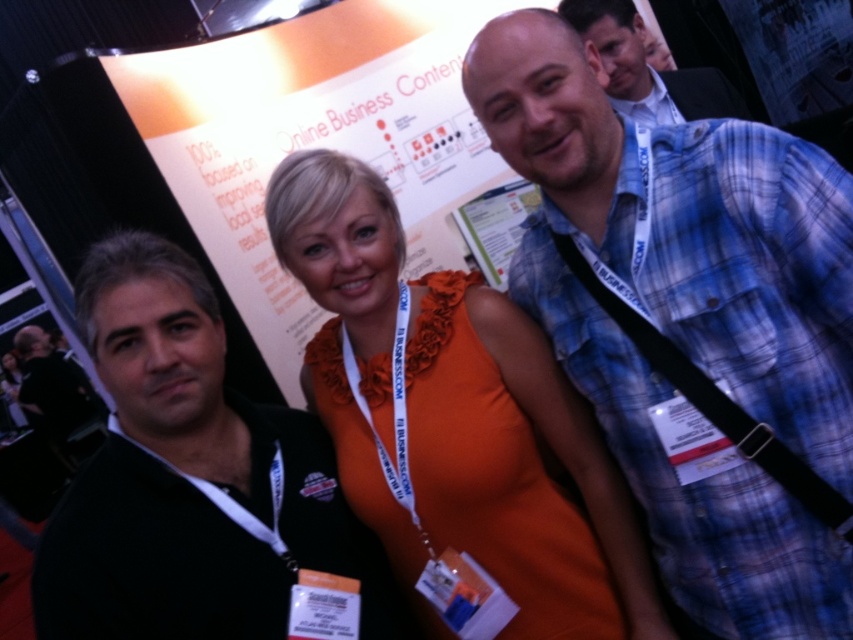
You are at a trade show and need to determine which item is narrower between the black fabric lanyard at right and the blue plaid shirt at upper right. Can you identify the narrower one?

The black fabric lanyard at right has a lesser width compared to the blue plaid shirt at upper right, so the black fabric lanyard at right is narrower.

From the picture: You are at a trade show and want to find the orange satin dress at center. Where should you look relative to the black matte jacket at left?

The orange satin dress at center is located above the black matte jacket at left, so you should look upwards from the black matte jacket at left to find it.

In the scene of a business or trade show event with a backdrop about online business content, there are two people wearing an orange satin dress at center and a blue plaid shirt at upper right. From the perspective of someone standing in front of the backdrop, which clothing item is positioned lower?

The orange satin dress at center is below the blue plaid shirt at upper right, so the orange satin dress at center is positioned lower.